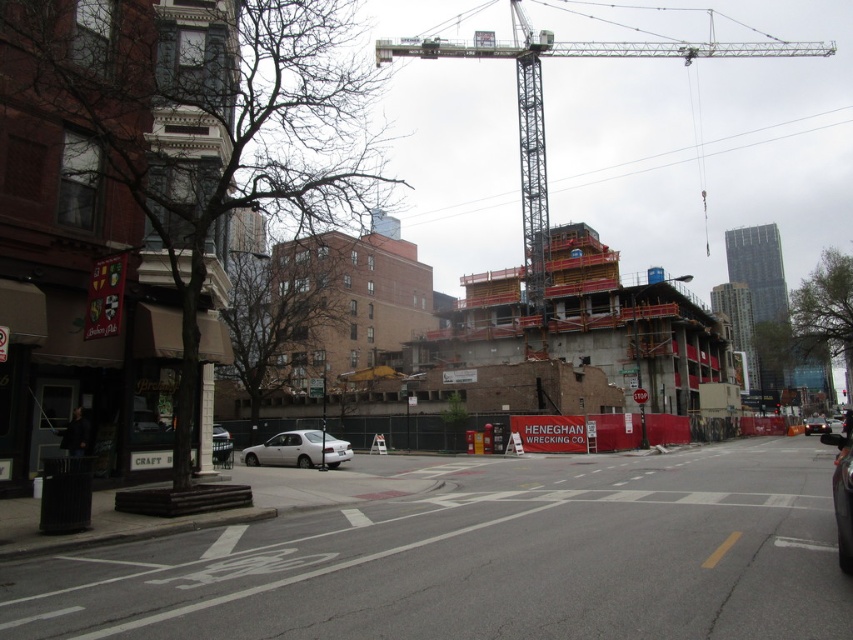
Does point (554, 467) lie behind point (276, 460)?

No, it is not.

Does smooth asphalt road at center lie behind silver metallic sedan at center?

No, it is in front of silver metallic sedan at center.

This screenshot has height=640, width=853. In order to click on smooth asphalt road at center in this screenshot , I will do `click(486, 560)`.

Who is taller, metallic gray crane at upper center or shiny black sedan at center?

With more height is metallic gray crane at upper center.

Can you confirm if metallic gray crane at upper center is smaller than shiny black sedan at center?

No, metallic gray crane at upper center is not smaller than shiny black sedan at center.

This screenshot has width=853, height=640. Describe the element at coordinates (573, 99) in the screenshot. I see `metallic gray crane at upper center` at that location.

This screenshot has width=853, height=640. In order to click on metallic gray crane at upper center in this screenshot , I will do `click(573, 99)`.

Between smooth asphalt road at center and metallic gray crane at upper center, which one has more height?

metallic gray crane at upper center

Does smooth asphalt road at center appear on the left side of metallic gray crane at upper center?

Correct, you'll find smooth asphalt road at center to the left of metallic gray crane at upper center.

Measure the distance between smooth asphalt road at center and camera.

They are 16.95 feet apart.

Locate an element on the screen. The width and height of the screenshot is (853, 640). smooth asphalt road at center is located at coordinates (486, 560).